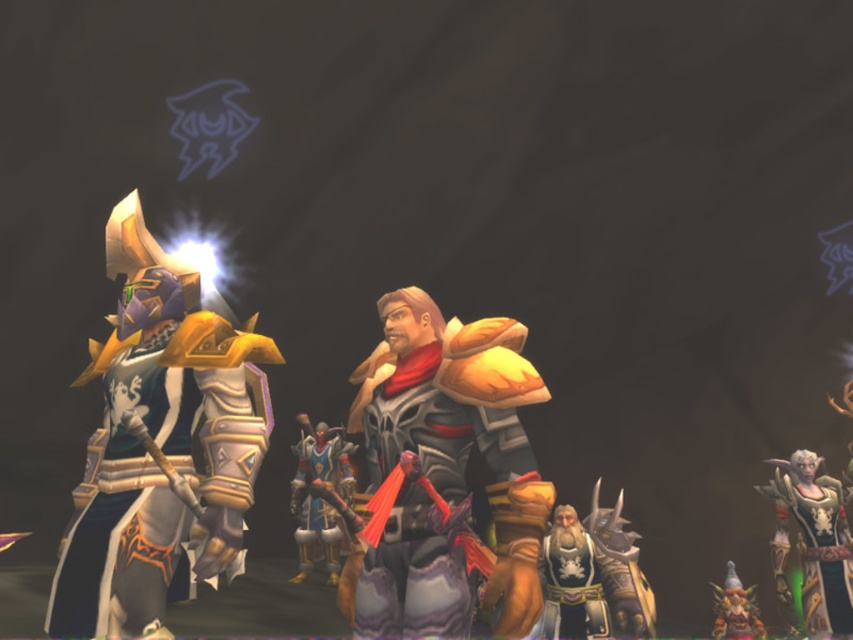
Question: Is shiny gold armor at left above gold plated armor at left?

Choices:
 (A) no
 (B) yes

Answer: (A)

Question: Among these points, which one is farthest from the camera?

Choices:
 (A) (183, 588)
 (B) (241, 504)

Answer: (A)

Question: Does shiny gold armor at left appear on the left side of gold plated armor at left?

Choices:
 (A) yes
 (B) no

Answer: (A)

Question: Can you confirm if shiny gold armor at left is positioned above gold plated armor at left?

Choices:
 (A) yes
 (B) no

Answer: (B)

Question: Which point appears closest to the camera in this image?

Choices:
 (A) (132, 490)
 (B) (138, 364)

Answer: (A)